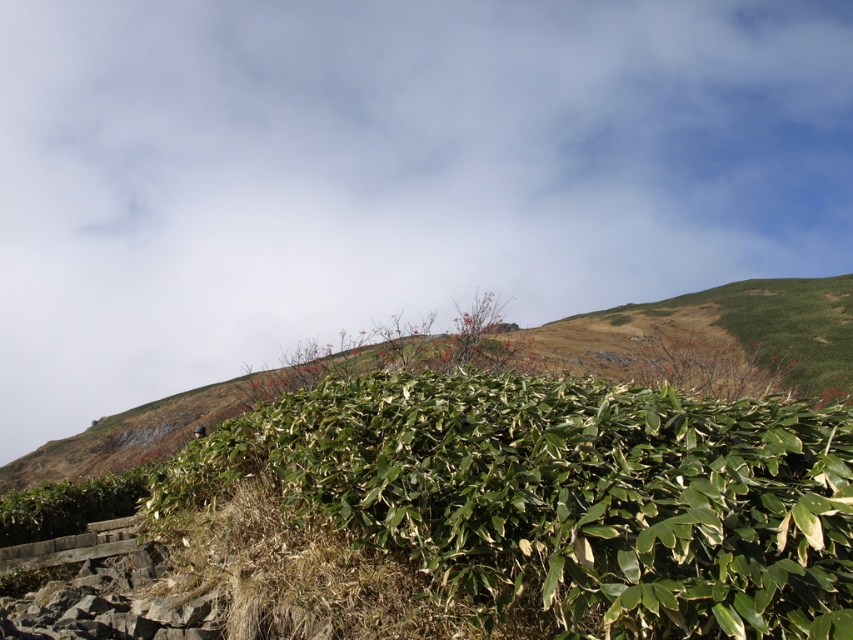
Based on the scene description, can you identify what is located at the coordinates point (387, 173)?

At point (387, 173) lies white fluffy cloud at upper center.

You are standing at the base of the hill and want to take a photo of both the white fluffy cloud at upper center and the green leafy bush at center. Can you fit both into your camera frame if your camera has a maximum viewing distance of 35 meters?

The white fluffy cloud at upper center and the green leafy bush at center are 37.21 meters apart. Since the distance between them exceeds the camera frame limit of 35 meters, you cannot fit both into the frame.